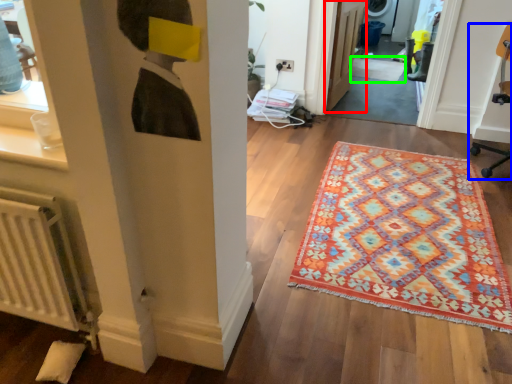
Question: Which object is positioned farthest from door (highlighted by a red box)? Select from swivel chair (highlighted by a blue box) and doormat (highlighted by a green box).

Choices:
 (A) swivel chair
 (B) doormat

Answer: (A)